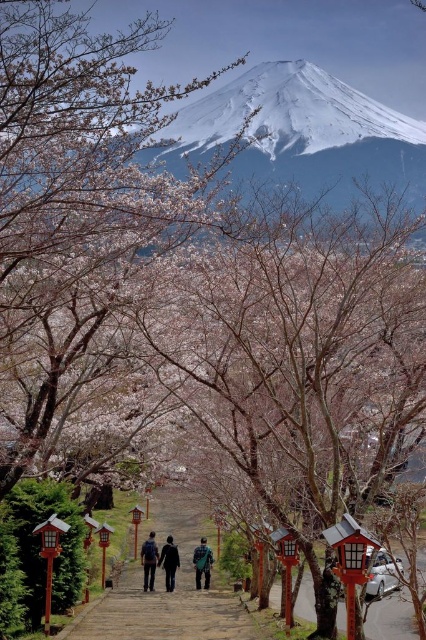
You are standing at the camera position and want to locate the dark blue jacket at center. What are its coordinates in the image?

The dark blue jacket at center is located at coordinates 0.880 on the x axis and 0.397 on the y axis.

You are planning to take a photo of the pink blossom tree at center and the dark blue backpack at center from the current viewpoint. Which object will appear larger in the photo?

The pink blossom tree at center will appear larger in the photo because it is wider than the dark blue backpack at center.

You are standing on the path under the cherry blossoms and see two people wearing jackets. Which jacket is closer to the left side of the path? The jackets are labeled as dark blue jacket at center and green fabric jacket at center.

The dark blue jacket at center is to the left of the green fabric jacket at center, so the dark blue jacket at center is closer to the left side of the path.